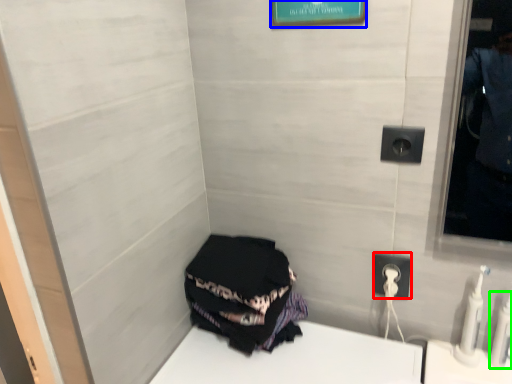
Question: Which is nearer to the power outlet (highlighted by a red box)? picture frame (highlighted by a blue box) or toiletry (highlighted by a green box).

Choices:
 (A) picture frame
 (B) toiletry

Answer: (B)